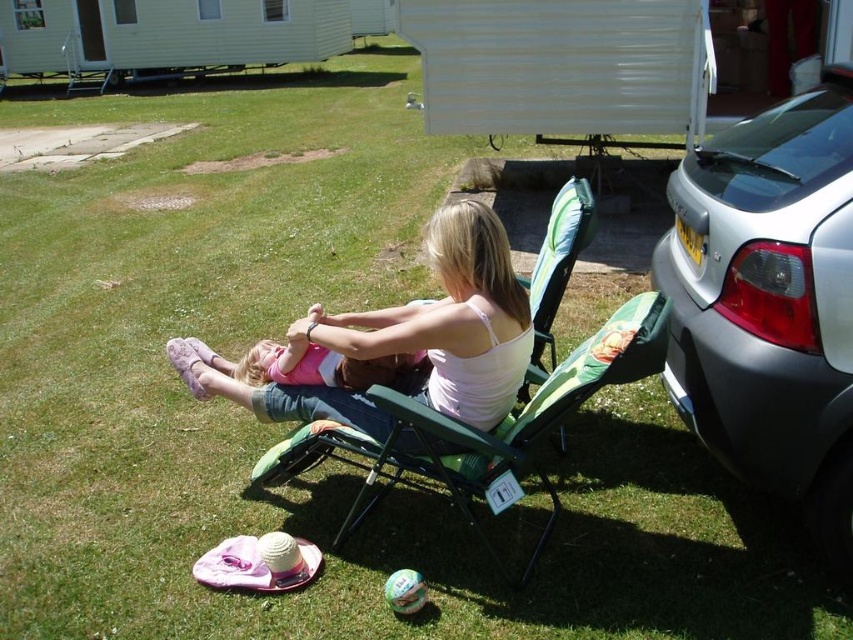
Question: Can you confirm if silver metallic car at right is thinner than green fabric chair at center?

Choices:
 (A) yes
 (B) no

Answer: (A)

Question: Can you confirm if silver metallic car at right is thinner than pink fabric baby at center?

Choices:
 (A) no
 (B) yes

Answer: (A)

Question: Which point is closer to the camera taking this photo?

Choices:
 (A) coord(477,310)
 (B) coord(850,464)
 (C) coord(258,349)
 (D) coord(335,420)

Answer: (B)

Question: Does silver metallic car at right come behind pink fabric dress at center?

Choices:
 (A) yes
 (B) no

Answer: (B)

Question: Based on their relative distances, which object is nearer to the pink fabric dress at center?

Choices:
 (A) silver metallic car at right
 (B) pink fabric baby at center
 (C) green fabric chair at center

Answer: (B)

Question: Among these objects, which one is farthest from the camera?

Choices:
 (A) pink fabric baby at center
 (B) green fabric chair at center
 (C) pink fabric dress at center
 (D) silver metallic car at right

Answer: (A)